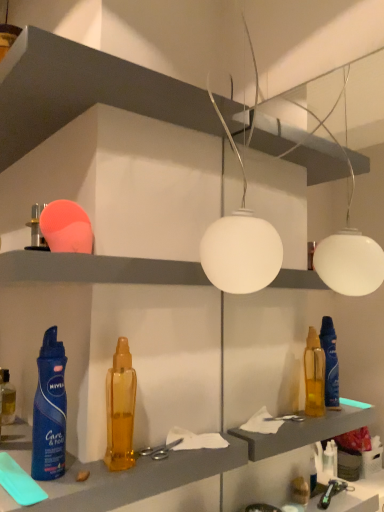
Locate an element on the screen. Image resolution: width=384 pixels, height=512 pixels. vacant space that is to the left of translucent amber bottle at center, the 2th bottle when ordered from back to front is located at coordinates (32, 470).